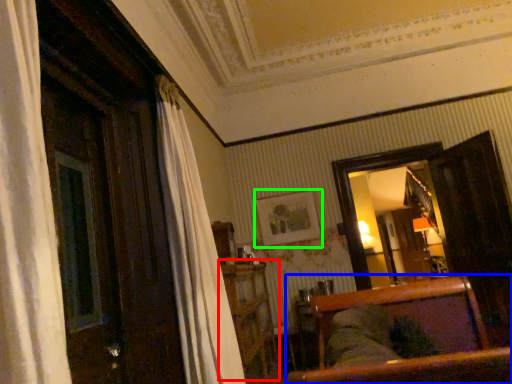
Question: Which is farther away from dresser (highlighted by a red box)? furniture (highlighted by a blue box) or picture frame (highlighted by a green box)?

Choices:
 (A) furniture
 (B) picture frame

Answer: (B)